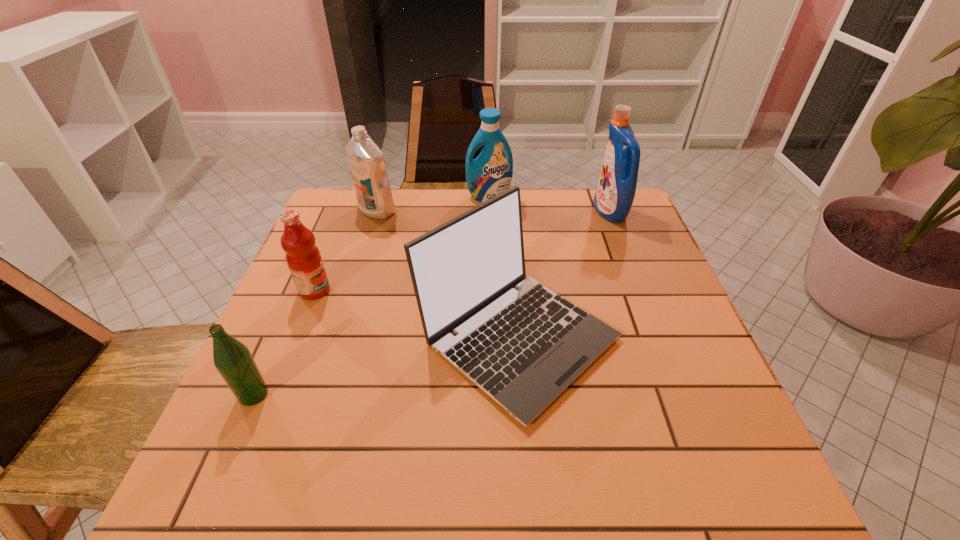
Find the location of a particular element. This screenshot has height=540, width=960. object situated at the far right corner is located at coordinates (615, 192).

This screenshot has width=960, height=540. Identify the location of vacant area at the far edge. (424, 212).

The image size is (960, 540). I want to click on vacant space at the near edge of the desktop, so coord(382,451).

This screenshot has width=960, height=540. I want to click on blank space at the left edge, so click(x=270, y=370).

At what (x,y) coordinates should I click in order to perform the action: click on vacant space at the right edge of the desktop. Please return your answer as a coordinate pair (x, y). This screenshot has width=960, height=540. Looking at the image, I should click on (624, 335).

In the image, there is a desktop. Identify the location of vacant space at the far left corner. This screenshot has width=960, height=540. (340, 212).

You are a GUI agent. You are given a task and a screenshot of the screen. Output one action in this format:
    pyautogui.click(x=<x>, y=<y>)
    Task: Click on the free space at the near left corner of the desktop
    This screenshot has height=540, width=960.
    Given the screenshot: What is the action you would take?
    pyautogui.click(x=243, y=500)

Find the location of a particular element. free space between the leftmost detergent and the bottle is located at coordinates (315, 302).

The image size is (960, 540). I want to click on free space between the second detergent from right to left and the shortest object, so click(x=372, y=295).

Identify the location of free space between the fruit juice and the second detergent from right to left. The image size is (960, 540). (401, 244).